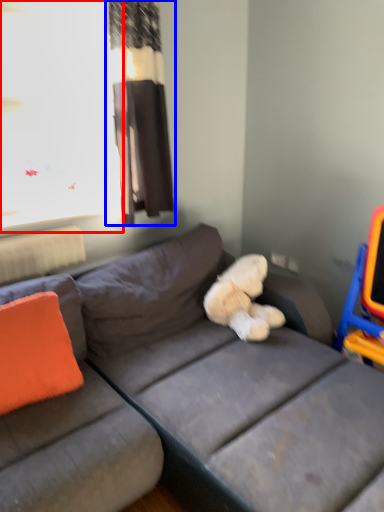
Question: Which object is closer to the camera taking this photo, window screen (highlighted by a red box) or curtain (highlighted by a blue box)?

Choices:
 (A) window screen
 (B) curtain

Answer: (A)